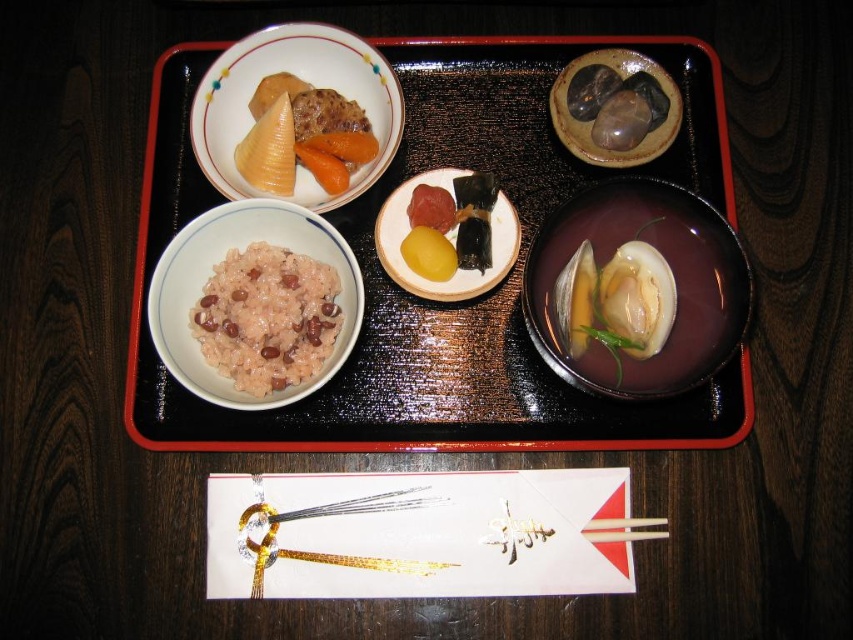
You are a guest at a Japanese meal and need to eat the matte brown rice at upper left using the white wood chopsticks at lower center. Can you pick up the rice with the chopsticks?

The matte brown rice at upper left has a larger size compared to white wood chopsticks at lower center, so the chopsticks may struggle to grip the rice properly due to their smaller size relative to the rice pieces.

In the scene shown: You are a food critic who wants to taste the orange smooth carrot at upper left before the smooth yellow rice cake at center. Given their heights, which one would you need to reach down lower to access?

The smooth yellow rice cake at center has a greater height compared to the orange smooth carrot at upper left, so you would need to reach down lower to access the orange smooth carrot at upper left since it is shorter.

You are a guest at a Japanese meal and want to reach for both the matte ceramic bowl at upper left and the matte brown bowl at upper right. Which bowl will your hand need to move less to reach first?

The matte ceramic bowl at upper left is closer to you than the matte brown bowl at upper right, so you can reach it with less movement.